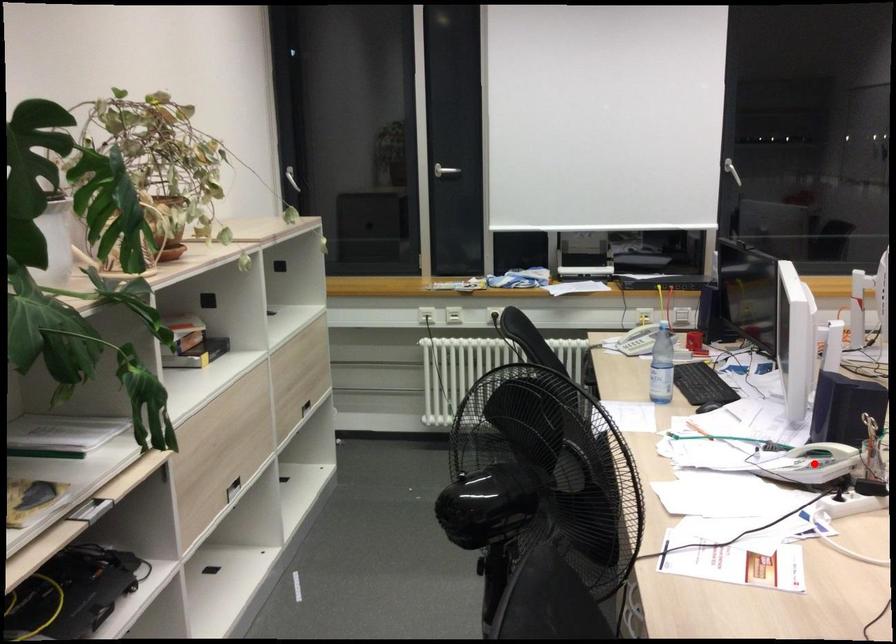
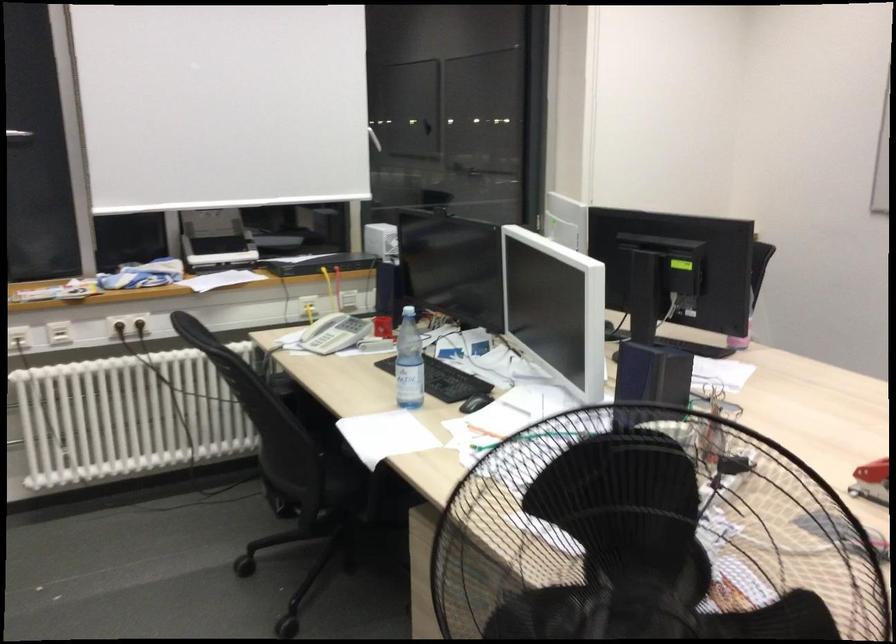
Question: I am providing you with two images of the same scene from different viewpoints. A red point is marked on the first image. Is the red point's position out of view in image 2?

Choices:
 (A) Yes
 (B) No

Answer: (A)